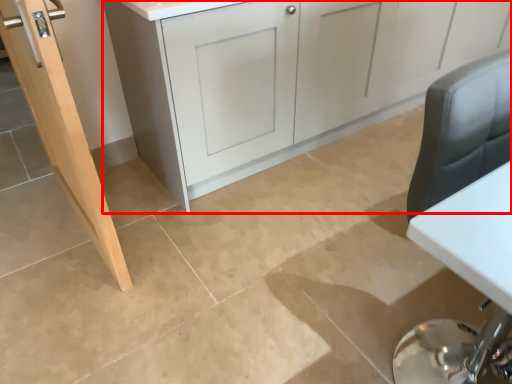
Question: Considering the relative positions of cabinetry (annotated by the red box) and door in the image provided, where is cabinetry (annotated by the red box) located with respect to the staircase?

Choices:
 (A) left
 (B) right

Answer: (B)